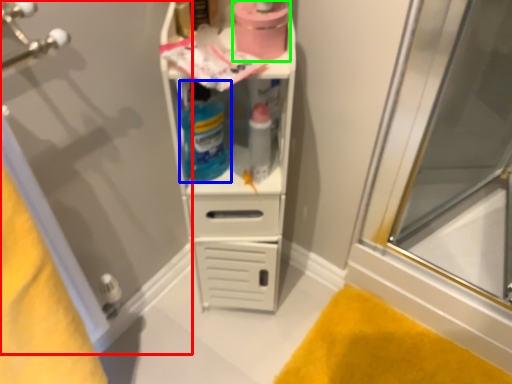
Question: Estimate the real-world distances between objects in this image. Which object is farther from screen door (highlighted by a red box), cleaning product (highlighted by a blue box) or toilet paper (highlighted by a green box)?

Choices:
 (A) cleaning product
 (B) toilet paper

Answer: (B)